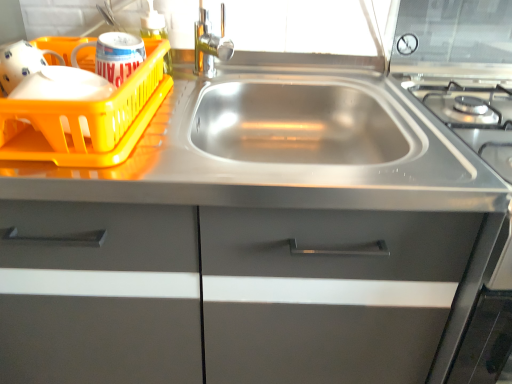
Question: Should I look upward or downward to see stainless steel sink at center?

Choices:
 (A) up
 (B) down

Answer: (B)

Question: Considering the relative sizes of stainless steel sink at center and stainless steel sink at center in the image provided, is stainless steel sink at center wider than stainless steel sink at center?

Choices:
 (A) no
 (B) yes

Answer: (A)

Question: Is the surface of stainless steel sink at center in direct contact with stainless steel sink at center?

Choices:
 (A) yes
 (B) no

Answer: (B)

Question: Is stainless steel sink at center facing towards stainless steel sink at center?

Choices:
 (A) no
 (B) yes

Answer: (B)

Question: From the image's perspective, would you say stainless steel sink at center is shown under stainless steel sink at center?

Choices:
 (A) no
 (B) yes

Answer: (A)

Question: Is stainless steel sink at center taller than stainless steel sink at center?

Choices:
 (A) yes
 (B) no

Answer: (B)

Question: Is stainless steel sink at center positioned with its back to stainless steel sink at center?

Choices:
 (A) yes
 (B) no

Answer: (A)

Question: Is stainless steel sink at center at the left side of yellow plastic basket at left?

Choices:
 (A) no
 (B) yes

Answer: (A)

Question: Is stainless steel sink at center shorter than yellow plastic basket at left?

Choices:
 (A) yes
 (B) no

Answer: (B)

Question: Is stainless steel sink at center thinner than yellow plastic basket at left?

Choices:
 (A) no
 (B) yes

Answer: (A)

Question: Is yellow plastic basket at left located within stainless steel sink at center?

Choices:
 (A) no
 (B) yes

Answer: (A)

Question: Can you confirm if stainless steel sink at center is positioned to the right of yellow plastic basket at left?

Choices:
 (A) no
 (B) yes

Answer: (B)

Question: Is stainless steel sink at center located outside yellow plastic basket at left?

Choices:
 (A) no
 (B) yes

Answer: (B)

Question: Considering the relative sizes of stainless steel sink at center and transparent plastic soap dispenser at upper center in the image provided, is stainless steel sink at center taller than transparent plastic soap dispenser at upper center?

Choices:
 (A) yes
 (B) no

Answer: (B)